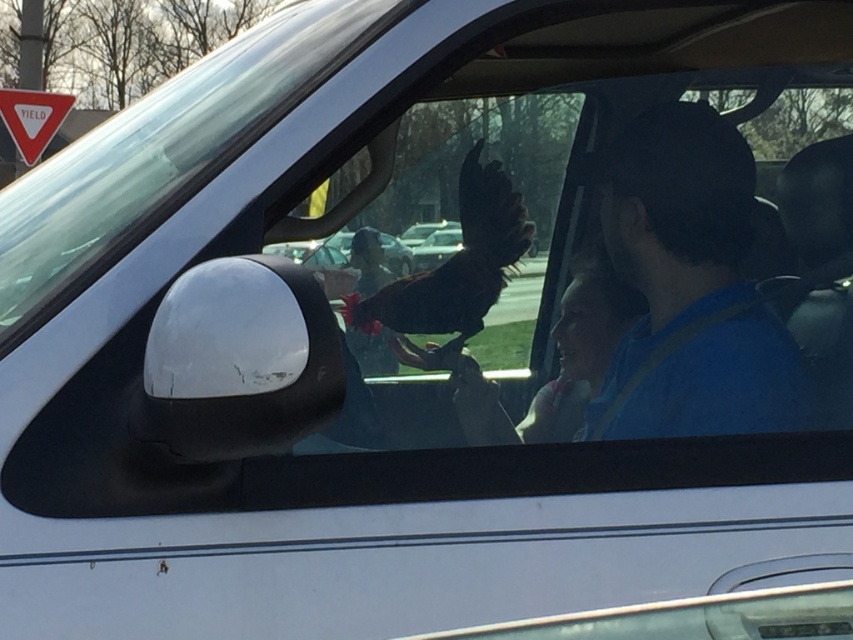
Question: Considering the relative positions of transparent glass windshield at center and yield sign at upper left in the image provided, where is transparent glass windshield at center located with respect to yield sign at upper left?

Choices:
 (A) left
 (B) right

Answer: (B)

Question: Is transparent glass windshield at center below yield sign at upper left?

Choices:
 (A) no
 (B) yes

Answer: (B)

Question: Does transparent glass windshield at center have a greater width compared to yield sign at upper left?

Choices:
 (A) yes
 (B) no

Answer: (A)